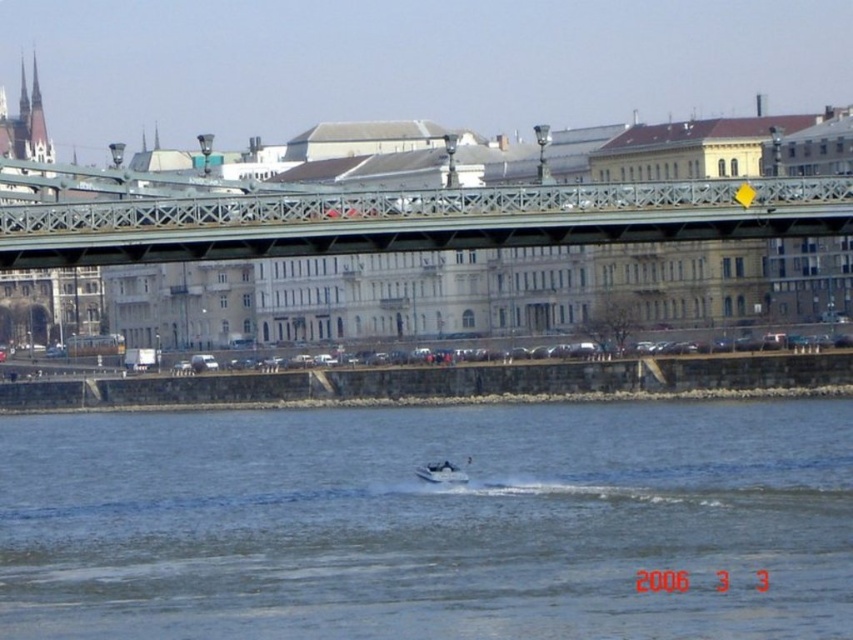
Who is lower down, metallic bridge at center or white plastic boat at center?

white plastic boat at center

Which is more to the right, metallic bridge at center or white plastic boat at center?

metallic bridge at center

Is point (476, 202) less distant than point (428, 467)?

Yes, point (476, 202) is in front of point (428, 467).

The image size is (853, 640). Identify the location of metallic bridge at center. (381, 216).

Which is more to the left, clear water at center or metallic bridge at center?

clear water at center is more to the left.

Which is in front, point (202, 433) or point (721, 180)?

Point (721, 180) is in front.

Measure the distance between clear water at center and camera.

57.65 meters

Identify the location of clear water at center. (428, 522).

Between point (402, 417) and point (421, 480), which one is positioned behind?

The point (402, 417) is behind.

Does clear water at center appear over white plastic boat at center?

Correct, clear water at center is located above white plastic boat at center.

What do you see at coordinates (428, 522) in the screenshot? I see `clear water at center` at bounding box center [428, 522].

Where is `clear water at center`? This screenshot has width=853, height=640. clear water at center is located at coordinates (428, 522).